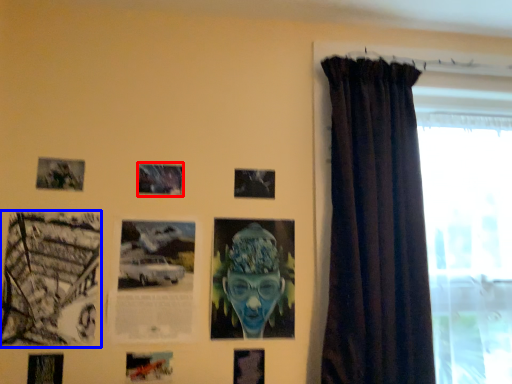
Question: Which of the following is the farthest to the observer, picture frame (highlighted by a red box) or picture frame (highlighted by a blue box)?

Choices:
 (A) picture frame
 (B) picture frame

Answer: (A)